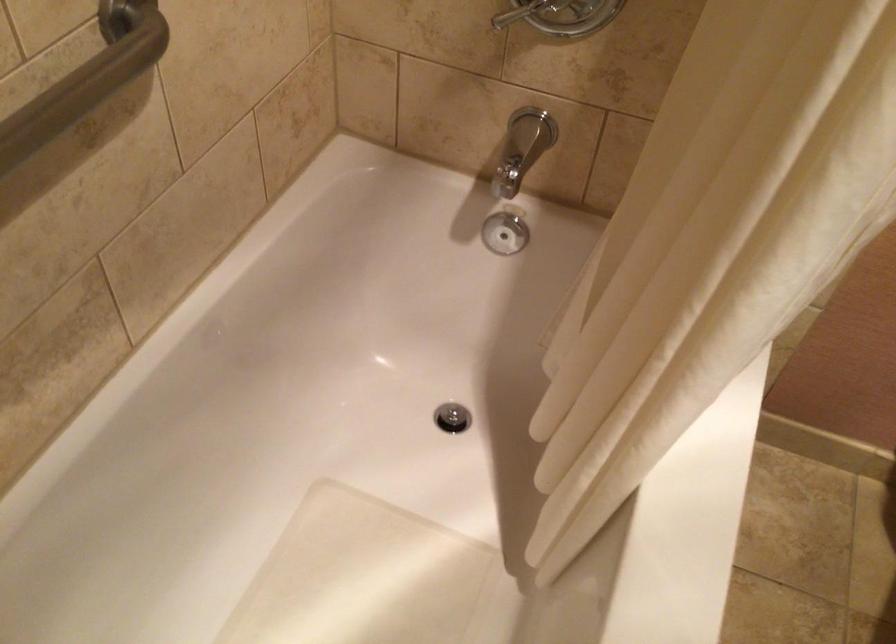
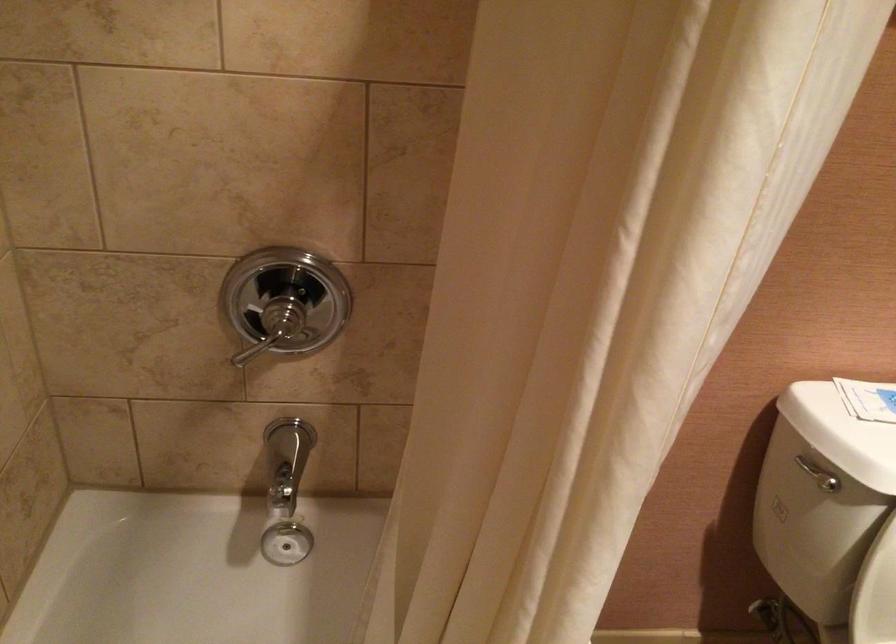
Question: The camera is either moving clockwise (left) or counter-clockwise (right) around the object. The first image is from the beginning of the video and the second image is from the end. Is the camera moving left or right when shooting the video?

Choices:
 (A) Left
 (B) Right

Answer: (A)